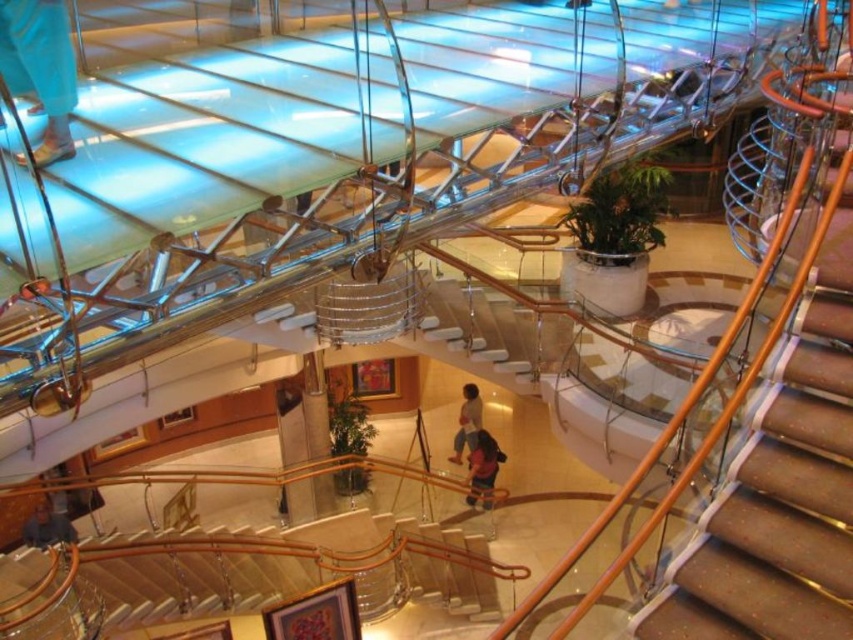
Question: Can you confirm if matte blue jeans at upper left is bigger than dark blue shirt at center?

Choices:
 (A) yes
 (B) no

Answer: (B)

Question: Does dark blue shirt at center have a lesser width compared to blue denim jeans at lower left?

Choices:
 (A) yes
 (B) no

Answer: (A)

Question: Which point appears farthest from the camera in this image?

Choices:
 (A) (84, 568)
 (B) (4, 26)
 (C) (477, 456)

Answer: (C)

Question: Based on their relative distances, which object is farther from the wooden stairs at center?

Choices:
 (A) light brown leather jacket at center
 (B) matte blue jeans at upper left

Answer: (A)

Question: Which object is farther from the camera taking this photo?

Choices:
 (A) dark blue shirt at center
 (B) matte blue jeans at upper left

Answer: (A)

Question: Can you confirm if matte blue jeans at upper left is positioned to the right of dark blue shirt at center?

Choices:
 (A) yes
 (B) no

Answer: (B)